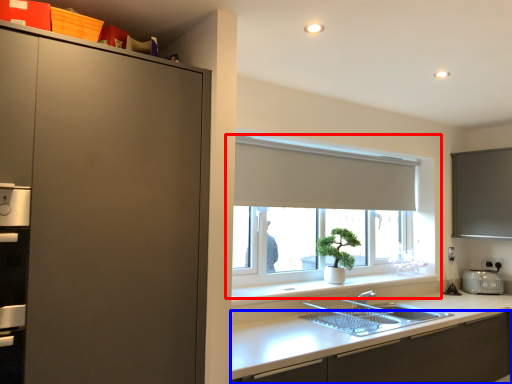
Question: Which of the following is the closest to the observer, window (highlighted by a red box) or cabinetry (highlighted by a blue box)?

Choices:
 (A) window
 (B) cabinetry

Answer: (B)